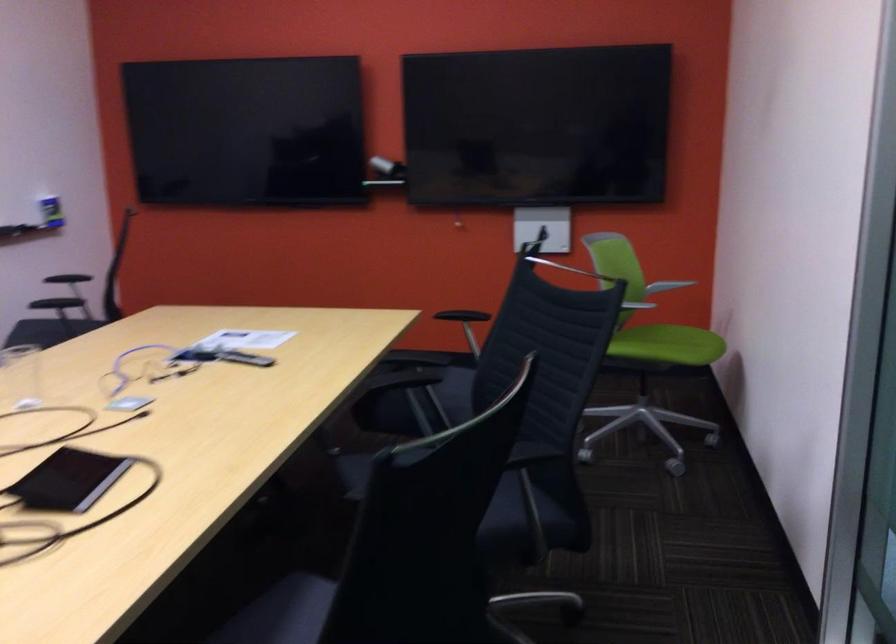
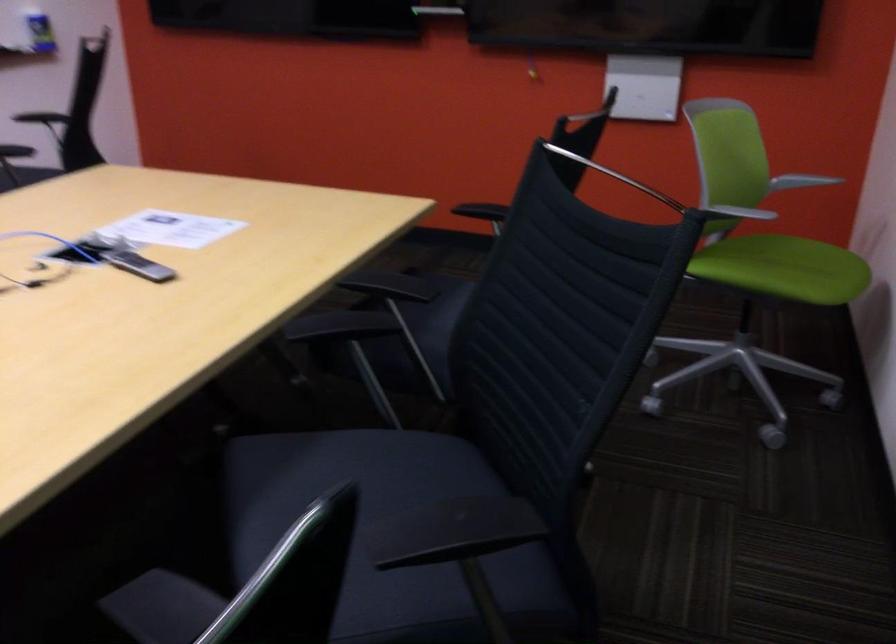
Question: In a continuous first-person perspective shot, in which direction is the camera moving?

Choices:
 (A) Left
 (B) Right
 (C) Forward
 (D) Backward

Answer: (C)